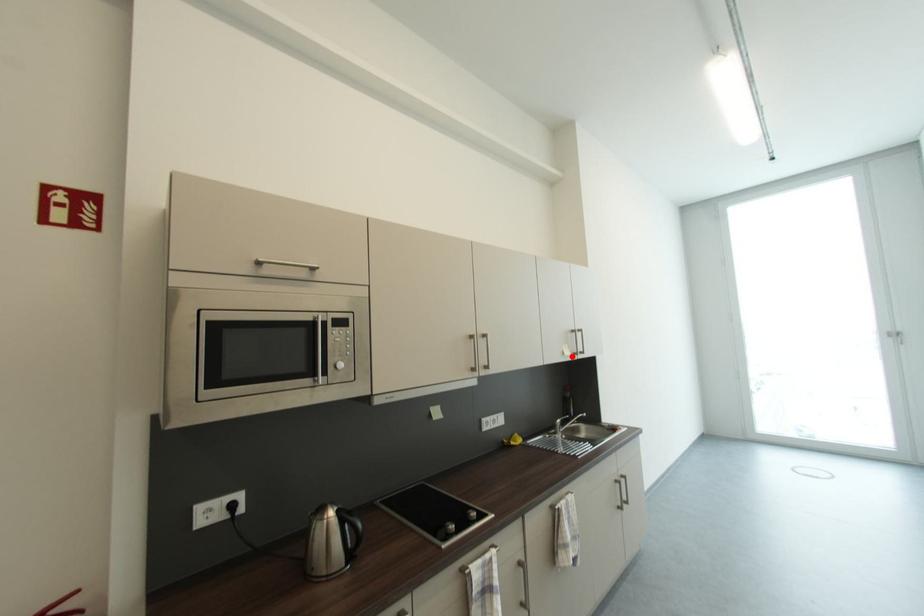
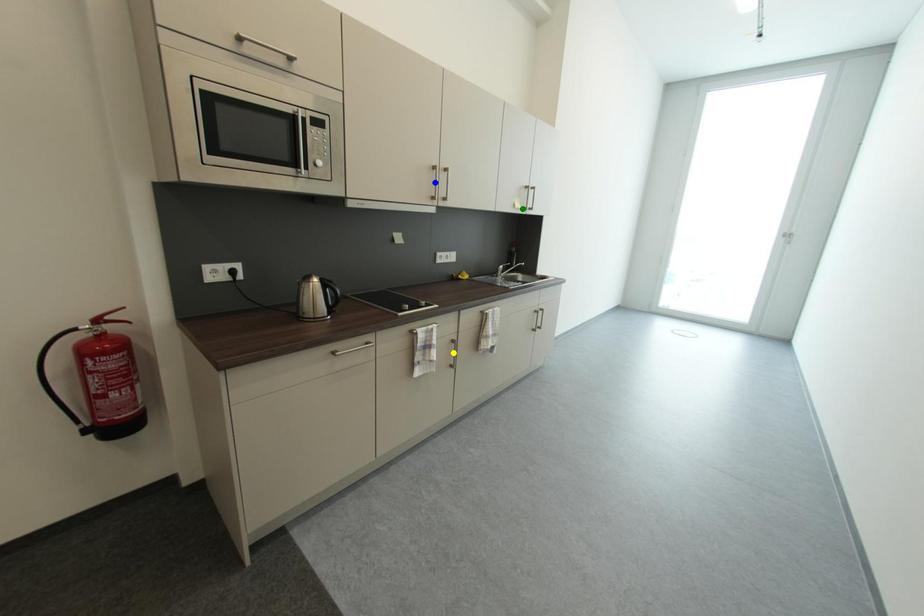
Question: I am providing you with two images of the same scene from different viewpoints. A red point is marked on the first image. You are given multiple points on the second image. Which point in image 2 represents the same 3d spot as the red point in image 1?

Choices:
 (A) blue point
 (B) green point
 (C) yellow point

Answer: (B)